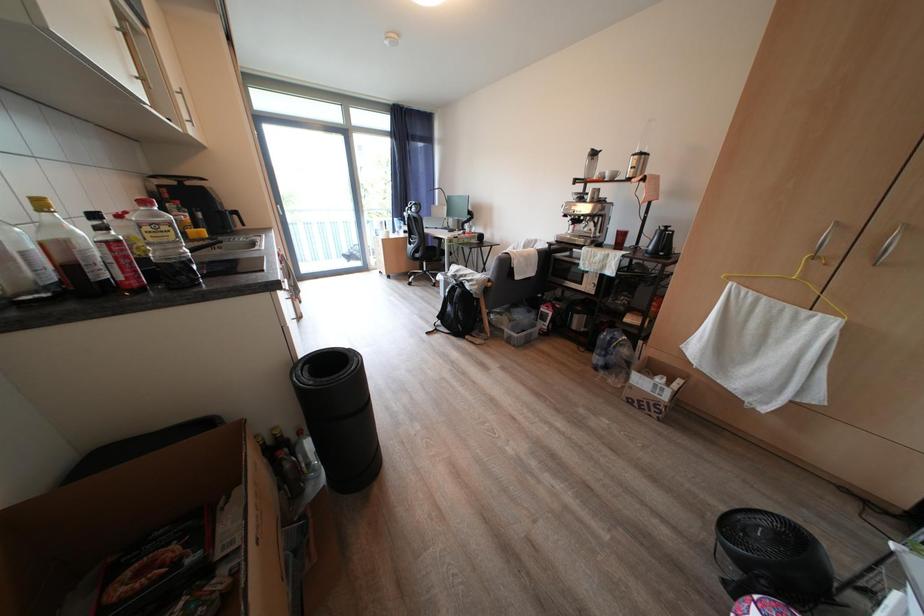
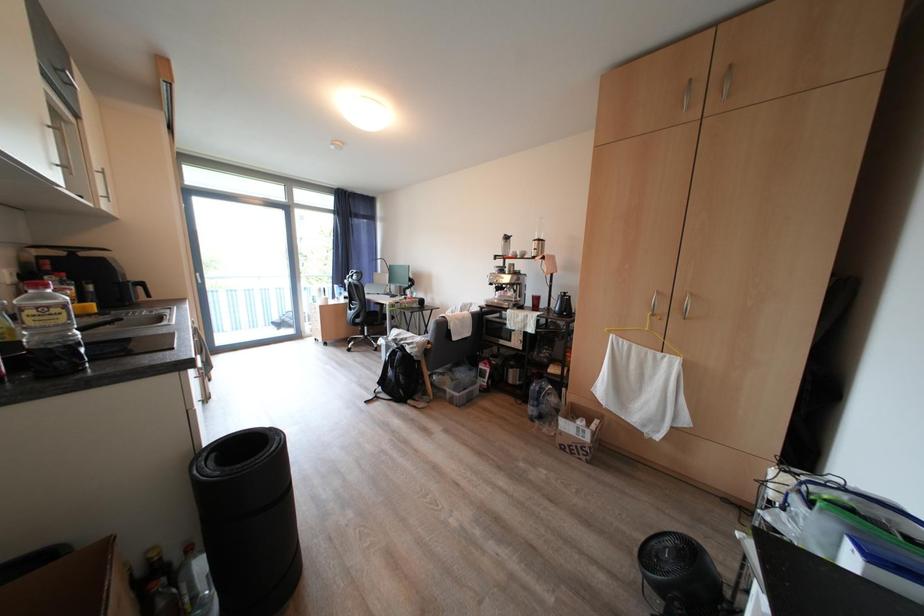
The images are taken continuously from a first-person perspective. In which direction are you moving?

The cameraman walked toward right, backward.